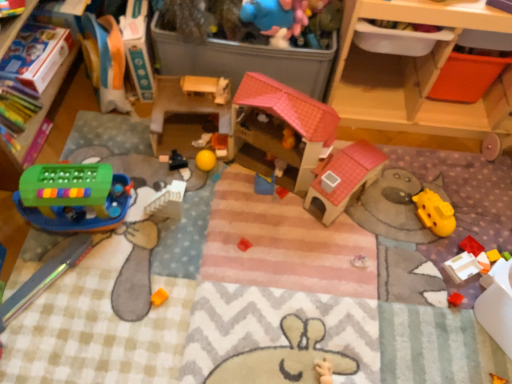
The width and height of the screenshot is (512, 384). Identify the location of free space in front of white matte figurine at center, which ranks as the 4th toy in left-to-right order. (189, 184).